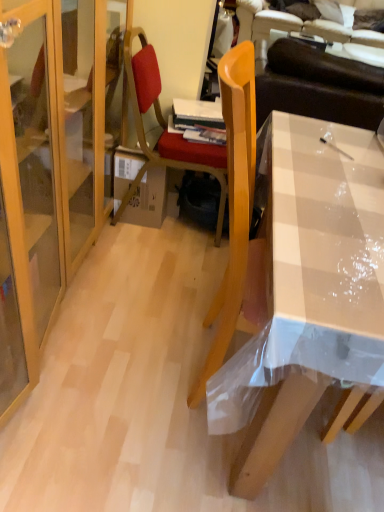
Question: Choose the correct answer: Is wooden chair at center inside cardboard box at center or outside it?

Choices:
 (A) outside
 (B) inside

Answer: (A)

Question: In the image, is wooden chair at center positioned in front of or behind cardboard box at center?

Choices:
 (A) front
 (B) behind

Answer: (A)

Question: Which object is positioned farthest from the brown leather couch at upper right?

Choices:
 (A) clear plastic desk at center
 (B) wooden chair at center
 (C) cardboard box at center

Answer: (A)

Question: Which is farther from the clear plastic desk at center?

Choices:
 (A) brown leather couch at upper right
 (B) wooden chair at center
 (C) cardboard box at center

Answer: (A)